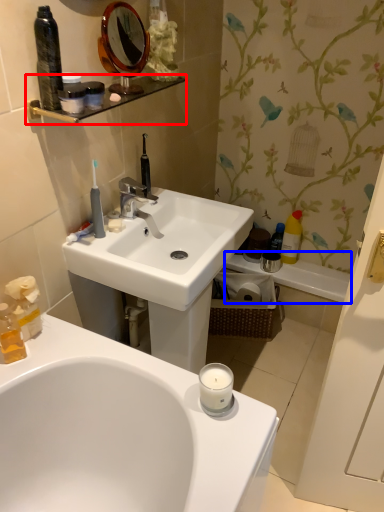
Question: Which of the following is the closest to the observer, balustrade (highlighted by a red box) or bath (highlighted by a blue box)?

Choices:
 (A) balustrade
 (B) bath

Answer: (A)